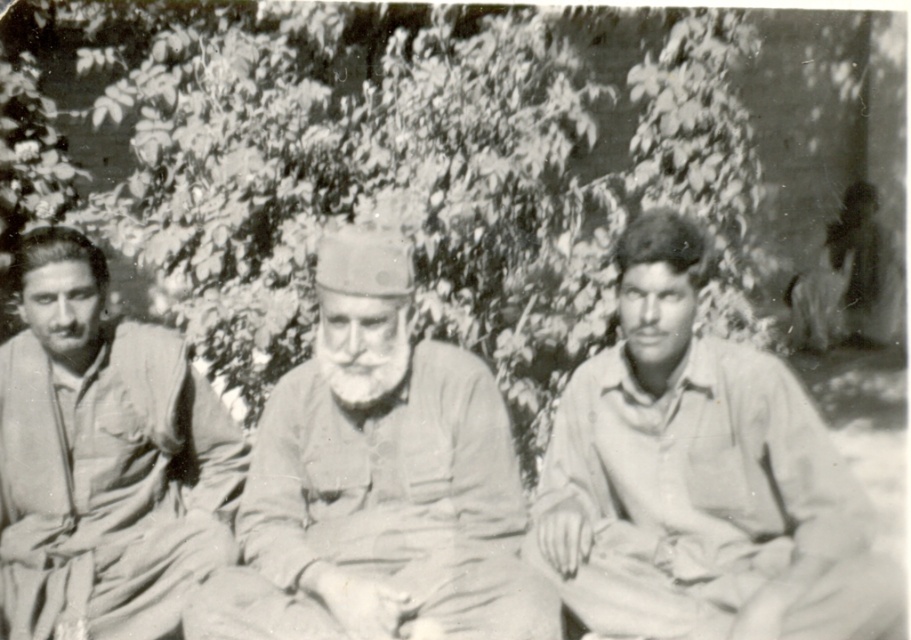
Does point (449, 372) come in front of point (15, 593)?

That is True.

Is light gray fabric cap at center to the left of matte khaki uniform at center from the viewer's perspective?

No, light gray fabric cap at center is not to the left of matte khaki uniform at center.

Is point (195, 602) farther from camera compared to point (70, 252)?

That is False.

You are a GUI agent. You are given a task and a screenshot of the screen. Output one action in this format:
    pyautogui.click(x=<x>, y=<y>)
    Task: Click on the light gray fabric cap at center
    The height and width of the screenshot is (640, 911).
    Given the screenshot: What is the action you would take?
    pyautogui.click(x=377, y=481)

Looking at this image, can you confirm if light gray shirt at center is positioned to the left of matte khaki uniform at center?

No, light gray shirt at center is not to the left of matte khaki uniform at center.

This screenshot has width=911, height=640. What do you see at coordinates (700, 480) in the screenshot? I see `light gray shirt at center` at bounding box center [700, 480].

Between point (646, 413) and point (145, 433), which one is positioned in front?

Point (646, 413) is in front.

Locate an element on the screen. Image resolution: width=911 pixels, height=640 pixels. light gray shirt at center is located at coordinates (700, 480).

Who is positioned more to the left, light gray shirt at center or light gray fabric cap at center?

light gray fabric cap at center is more to the left.

Can you confirm if light gray shirt at center is positioned to the right of light gray fabric cap at center?

Indeed, light gray shirt at center is positioned on the right side of light gray fabric cap at center.

Identify the location of light gray shirt at center. The width and height of the screenshot is (911, 640). (700, 480).

In order to click on light gray shirt at center in this screenshot , I will do (700, 480).